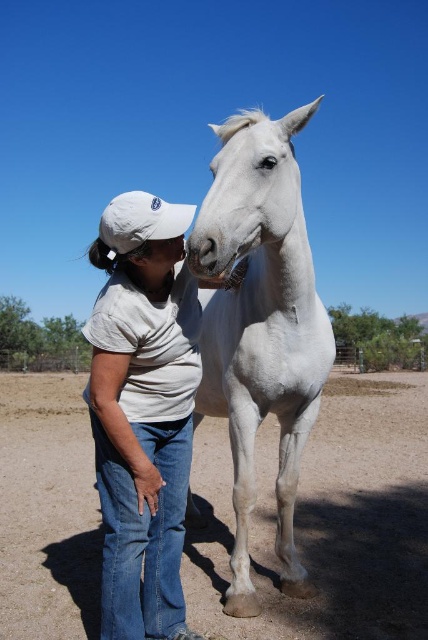
Question: Which of the following is the farthest from the observer?

Choices:
 (A) (17, 532)
 (B) (136, 500)

Answer: (A)

Question: Is brown sandy dirt at lower center closer to camera compared to white cotton shirt at center?

Choices:
 (A) yes
 (B) no

Answer: (B)

Question: Does white cotton shirt at center appear on the left side of white glossy horse at center?

Choices:
 (A) yes
 (B) no

Answer: (A)

Question: Can you confirm if white cotton shirt at center is positioned to the left of white glossy horse at center?

Choices:
 (A) no
 (B) yes

Answer: (B)

Question: Which object is the farthest from the brown sandy dirt at lower center?

Choices:
 (A) white glossy horse at center
 (B) white cotton shirt at center

Answer: (B)

Question: Which point is closer to the camera?

Choices:
 (A) brown sandy dirt at lower center
 (B) white cotton shirt at center

Answer: (B)